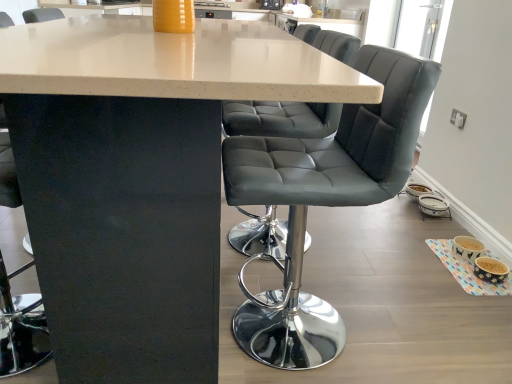
Question: Is there a large distance between matte gray leather chair at center and matte white table at center?

Choices:
 (A) yes
 (B) no

Answer: (B)

Question: Does matte gray leather chair at center have a greater height compared to matte white table at center?

Choices:
 (A) yes
 (B) no

Answer: (B)

Question: From the image's perspective, would you say matte gray leather chair at center is positioned over matte white table at center?

Choices:
 (A) yes
 (B) no

Answer: (B)

Question: From a real-world perspective, is matte gray leather chair at center located higher than matte white table at center?

Choices:
 (A) no
 (B) yes

Answer: (B)

Question: Considering the relative sizes of matte gray leather chair at center and matte white table at center in the image provided, is matte gray leather chair at center smaller than matte white table at center?

Choices:
 (A) no
 (B) yes

Answer: (B)

Question: From a real-world perspective, does matte gray leather chair at center sit lower than matte white table at center?

Choices:
 (A) no
 (B) yes

Answer: (A)

Question: From the image's perspective, is matte white table at center above matte gray leather chair at center?

Choices:
 (A) yes
 (B) no

Answer: (A)

Question: Is matte white table at center positioned before matte gray leather chair at center?

Choices:
 (A) yes
 (B) no

Answer: (A)

Question: Would you say matte gray leather chair at center is part of matte white table at center's contents?

Choices:
 (A) no
 (B) yes

Answer: (B)

Question: Does matte white table at center turn towards matte gray leather chair at center?

Choices:
 (A) no
 (B) yes

Answer: (A)

Question: Does matte white table at center have a lesser height compared to matte gray leather chair at center?

Choices:
 (A) no
 (B) yes

Answer: (A)

Question: From a real-world perspective, is matte white table at center located beneath matte gray leather chair at center?

Choices:
 (A) no
 (B) yes

Answer: (B)

Question: Is matte white table at center taller or shorter than matte gray leather chair at center?

Choices:
 (A) tall
 (B) short

Answer: (A)